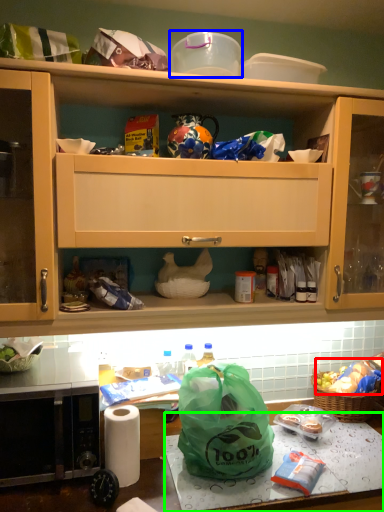
Question: Estimate the real-world distances between objects in this image. Which object is farther from food (highlighted by a red box), appliance (highlighted by a blue box) or table (highlighted by a green box)?

Choices:
 (A) appliance
 (B) table

Answer: (A)